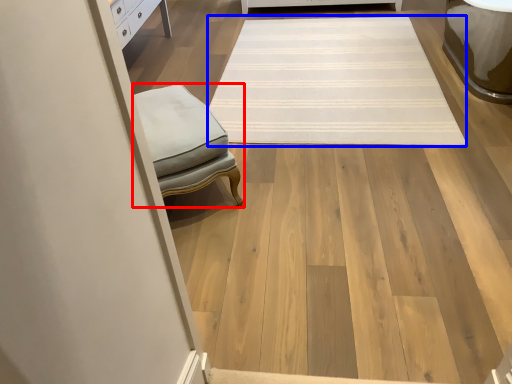
Question: Which of the following is the farthest to the observer, furniture (highlighted by a red box) or mat (highlighted by a blue box)?

Choices:
 (A) furniture
 (B) mat

Answer: (B)